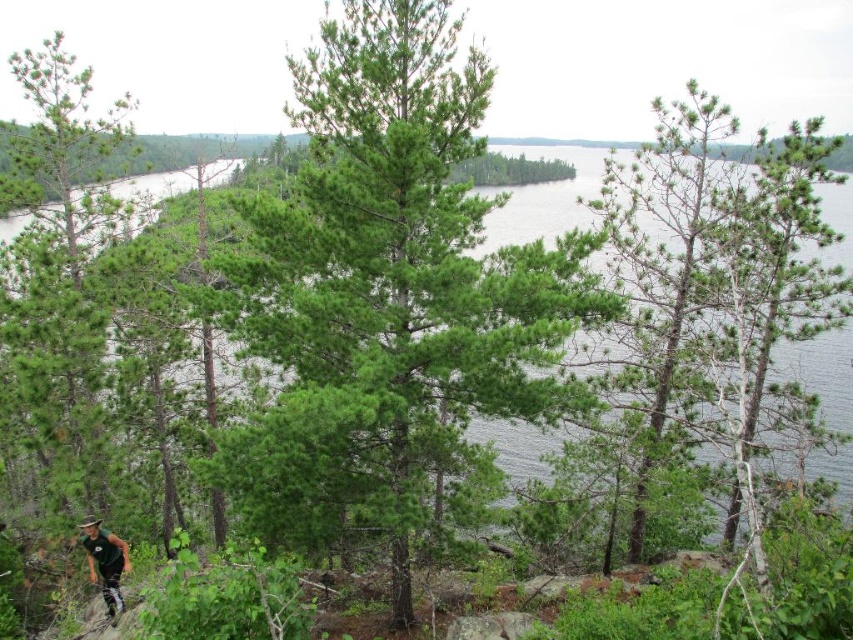
Does point (541, 148) lie in front of point (120, 557)?

That is False.

Is clear water at center positioned behind green fabric mountain biker at lower left?

Yes.

Which is in front, point (538, 474) or point (119, 600)?

Positioned in front is point (119, 600).

Find the location of a particular element. The width and height of the screenshot is (853, 640). clear water at center is located at coordinates (544, 196).

Is green matte tree at center further to the viewer compared to clear water at center?

No, it is in front of clear water at center.

Between green matte tree at center and clear water at center, which one has less height?

green matte tree at center

You are a GUI agent. You are given a task and a screenshot of the screen. Output one action in this format:
    pyautogui.click(x=<x>, y=<y>)
    Task: Click on the green matte tree at center
    Image resolution: width=853 pixels, height=640 pixels.
    Given the screenshot: What is the action you would take?
    pyautogui.click(x=386, y=289)

Is green matte tree at center above green fabric mountain biker at lower left?

Yes.

Between green matte tree at center and green fabric mountain biker at lower left, which one appears on the right side from the viewer's perspective?

Positioned to the right is green matte tree at center.

Does point (254, 253) come farther from viewer compared to point (103, 554)?

Yes, point (254, 253) is farther from viewer.

I want to click on green matte tree at center, so click(x=386, y=289).